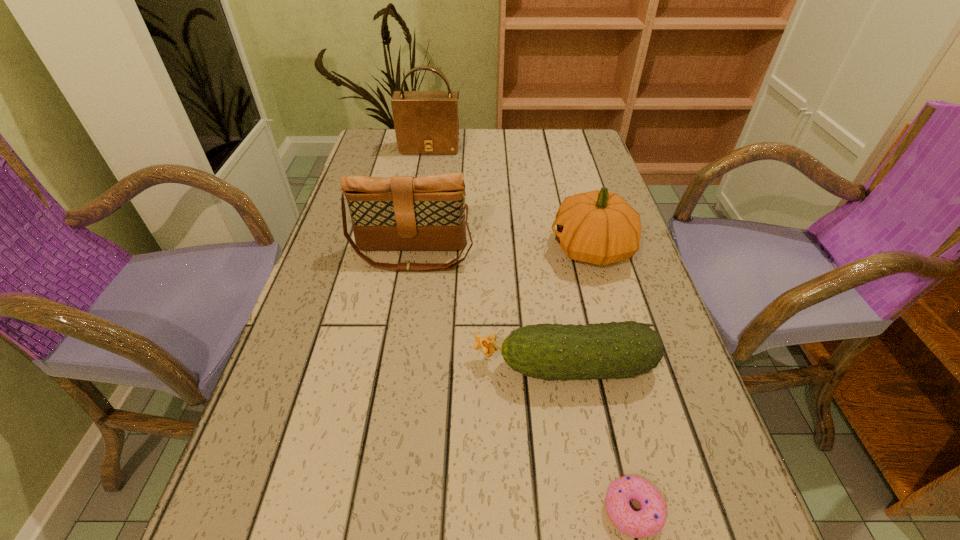
The height and width of the screenshot is (540, 960). I want to click on the farthest object, so click(426, 122).

The image size is (960, 540). In order to click on the farther shoulder bag in this screenshot , I will do `click(426, 122)`.

The height and width of the screenshot is (540, 960). I want to click on the shorter shoulder bag, so click(401, 213).

Locate an element on the screen. the fourth shortest object is located at coordinates (401, 213).

Identify the location of gourd. The image size is (960, 540). (599, 227).

The height and width of the screenshot is (540, 960). Find the location of `the second nearest object`. the second nearest object is located at coordinates (616, 350).

This screenshot has height=540, width=960. I want to click on cucumber, so click(616, 350).

Find the location of a particular element. vacant space located 0.240m on the front flap of the farther shoulder bag is located at coordinates (420, 200).

Find the location of a particular element. vacant area situated 0.080m on the front-facing side of the fourth shortest object is located at coordinates (405, 299).

Where is `free spot located on the side of the gourd with the carved face`? This screenshot has height=540, width=960. free spot located on the side of the gourd with the carved face is located at coordinates (477, 248).